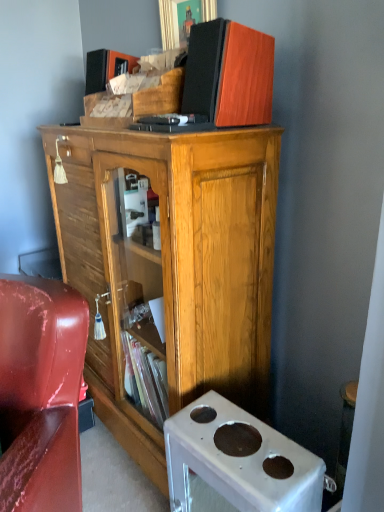
Locate an element on the screen. vacant area on top of white plastic desk at lower right (from a real-world perspective) is located at coordinates [x=224, y=423].